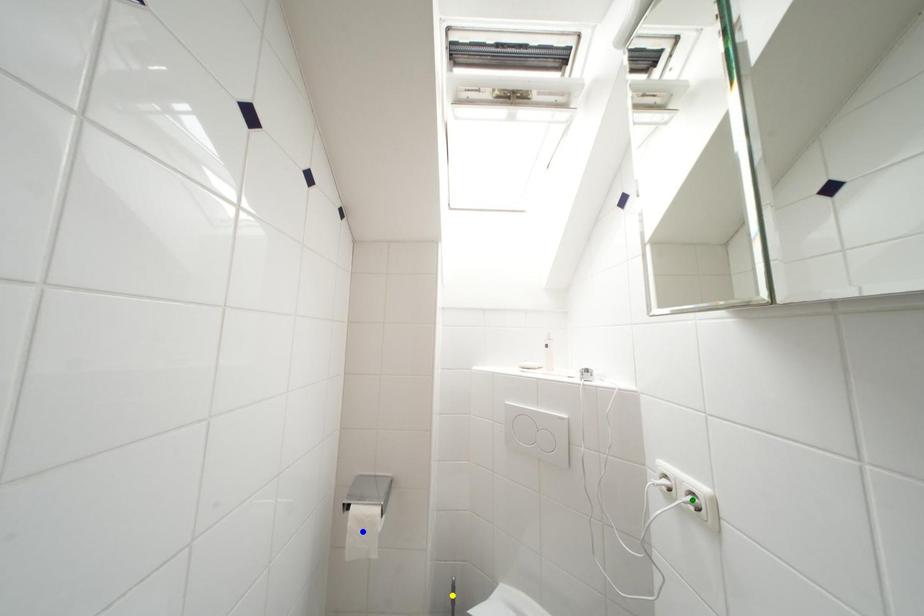
Order these from nearest to farthest:
A) green point
B) yellow point
C) blue point

green point → blue point → yellow point